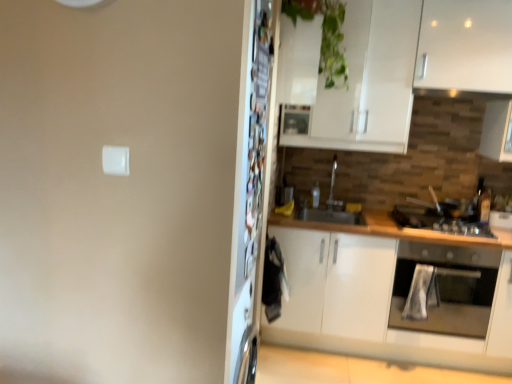
Question: From a real-world perspective, is white matte cabinet at right physically above metallic refrigerator at center?

Choices:
 (A) yes
 (B) no

Answer: (B)

Question: From the image's perspective, is white matte cabinet at right on metallic refrigerator at center?

Choices:
 (A) no
 (B) yes

Answer: (A)

Question: Is the position of white matte cabinet at right more distant than that of metallic refrigerator at center?

Choices:
 (A) no
 (B) yes

Answer: (B)

Question: Does white matte cabinet at right have a larger size compared to metallic refrigerator at center?

Choices:
 (A) yes
 (B) no

Answer: (A)

Question: Could metallic refrigerator at center be considered to be inside white matte cabinet at right?

Choices:
 (A) yes
 (B) no

Answer: (B)

Question: Can you confirm if white matte cabinet at right is shorter than metallic refrigerator at center?

Choices:
 (A) no
 (B) yes

Answer: (B)

Question: Is green glossy plant at upper center located within black matte gas stove at right?

Choices:
 (A) no
 (B) yes

Answer: (A)

Question: Does black matte gas stove at right have a lesser height compared to green glossy plant at upper center?

Choices:
 (A) yes
 (B) no

Answer: (A)

Question: Can you confirm if black matte gas stove at right is smaller than green glossy plant at upper center?

Choices:
 (A) yes
 (B) no

Answer: (A)

Question: Is black matte gas stove at right facing towards green glossy plant at upper center?

Choices:
 (A) yes
 (B) no

Answer: (B)

Question: Considering the relative sizes of black matte gas stove at right and green glossy plant at upper center in the image provided, is black matte gas stove at right wider than green glossy plant at upper center?

Choices:
 (A) no
 (B) yes

Answer: (B)

Question: Is black matte gas stove at right oriented away from green glossy plant at upper center?

Choices:
 (A) no
 (B) yes

Answer: (A)

Question: Is metallic refrigerator at center wider than black matte gas stove at right?

Choices:
 (A) yes
 (B) no

Answer: (B)